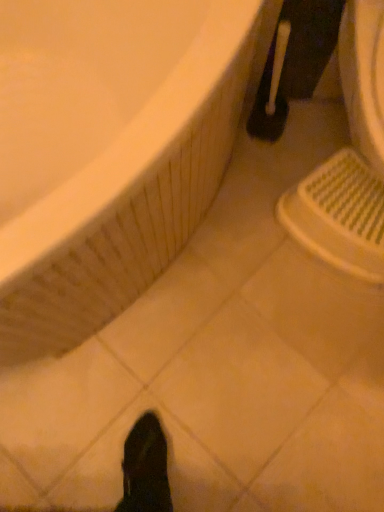
Question: Considering the positions of point (367, 194) and point (266, 88), is point (367, 194) closer or farther from the camera than point (266, 88)?

Choices:
 (A) farther
 (B) closer

Answer: (B)

Question: From a real-world perspective, is white plastic sink at lower right physically located above or below black plastic toilet brush at upper right?

Choices:
 (A) above
 (B) below

Answer: (A)

Question: Which of these objects is positioned closest to the white glossy bathtub at upper left?

Choices:
 (A) white plastic sink at lower right
 (B) black plastic toilet brush at upper right

Answer: (A)

Question: Estimate the real-world distances between objects in this image. Which object is farther from the black plastic toilet brush at upper right?

Choices:
 (A) white plastic sink at lower right
 (B) white glossy bathtub at upper left

Answer: (B)